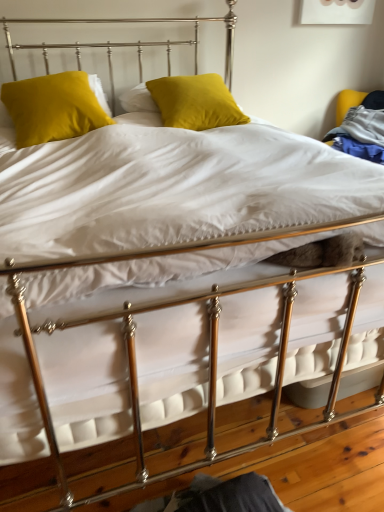
What is the approximate height of satin yellow pillow at center, which is counted as the 1th pillow, starting from the right?

26.45 centimeters.

This screenshot has height=512, width=384. I want to click on satin yellow pillow at center, which is counted as the 1th pillow, starting from the right, so click(x=195, y=102).

The image size is (384, 512). Describe the element at coordinates (195, 102) in the screenshot. I see `satin yellow pillow at center, which is counted as the 1th pillow, starting from the right` at that location.

This screenshot has height=512, width=384. Describe the element at coordinates (53, 106) in the screenshot. I see `velvet yellow pillow at upper left, the 1th pillow from the left` at that location.

In order to face velvet yellow pillow at upper left, the 1th pillow from the left, should I rotate leftwards or rightwards?

Rotate your view left by about 18.452°.

Find the location of a particular element. The width and height of the screenshot is (384, 512). velvet yellow pillow at upper left, the 1th pillow from the left is located at coordinates (53, 106).

Identify the location of satin yellow pillow at center, which is counted as the 1th pillow, starting from the right. The width and height of the screenshot is (384, 512). (195, 102).

Which is more to the right, velvet yellow pillow at upper left, the 1th pillow from the left, or satin yellow pillow at center, which is counted as the 1th pillow, starting from the right?

From the viewer's perspective, satin yellow pillow at center, which is counted as the 1th pillow, starting from the right, appears more on the right side.

Does velvet yellow pillow at upper left, which is the second pillow from right to left, come behind satin yellow pillow at center, which ranks as the 2th pillow in left-to-right order?

No, it is in front of satin yellow pillow at center, which ranks as the 2th pillow in left-to-right order.

Between point (17, 94) and point (169, 104), which one is positioned in front?

The point (17, 94) is closer.

From the image's perspective, which one is positioned lower, velvet yellow pillow at upper left, which is the second pillow from right to left, or satin yellow pillow at center, which ranks as the 2th pillow in left-to-right order?

From the image's view, velvet yellow pillow at upper left, which is the second pillow from right to left, is below.

From a real-world perspective, does velvet yellow pillow at upper left, which is the second pillow from right to left, stand above satin yellow pillow at center, which ranks as the 2th pillow in left-to-right order?

No.

Between velvet yellow pillow at upper left, the 1th pillow from the left, and satin yellow pillow at center, which is counted as the 1th pillow, starting from the right, which one has smaller width?

velvet yellow pillow at upper left, the 1th pillow from the left, is thinner.

Who is taller, velvet yellow pillow at upper left, which is the second pillow from right to left, or satin yellow pillow at center, which ranks as the 2th pillow in left-to-right order?

velvet yellow pillow at upper left, which is the second pillow from right to left, is taller.

Looking at the image, does velvet yellow pillow at upper left, which is the second pillow from right to left, seem bigger or smaller compared to satin yellow pillow at center, which is counted as the 1th pillow, starting from the right?

Considering their sizes, velvet yellow pillow at upper left, which is the second pillow from right to left, takes up more space than satin yellow pillow at center, which is counted as the 1th pillow, starting from the right.

Is velvet yellow pillow at upper left, the 1th pillow from the left, surrounding satin yellow pillow at center, which is counted as the 1th pillow, starting from the right?

No, velvet yellow pillow at upper left, the 1th pillow from the left, does not contain satin yellow pillow at center, which is counted as the 1th pillow, starting from the right.

Is velvet yellow pillow at upper left, which is the second pillow from right to left, touching satin yellow pillow at center, which ranks as the 2th pillow in left-to-right order?

They are not placed beside each other.

Is velvet yellow pillow at upper left, which is the second pillow from right to left, facing towards satin yellow pillow at center, which is counted as the 1th pillow, starting from the right?

No, velvet yellow pillow at upper left, which is the second pillow from right to left, does not turn towards satin yellow pillow at center, which is counted as the 1th pillow, starting from the right.

What's the angular difference between velvet yellow pillow at upper left, which is the second pillow from right to left, and satin yellow pillow at center, which is counted as the 1th pillow, starting from the right,'s facing directions?

The facing directions of velvet yellow pillow at upper left, which is the second pillow from right to left, and satin yellow pillow at center, which is counted as the 1th pillow, starting from the right, are 0.706 degrees apart.

Locate an element on the screen. pillow above the velvet yellow pillow at upper left, the 1th pillow from the left (from the image's perspective) is located at coordinates [x=195, y=102].

Considering the relative positions of satin yellow pillow at center, which ranks as the 2th pillow in left-to-right order, and velvet yellow pillow at upper left, which is the second pillow from right to left, in the image provided, is satin yellow pillow at center, which ranks as the 2th pillow in left-to-right order, to the left of velvet yellow pillow at upper left, which is the second pillow from right to left, from the viewer's perspective?

No.

In the image, is satin yellow pillow at center, which ranks as the 2th pillow in left-to-right order, positioned in front of or behind velvet yellow pillow at upper left, the 1th pillow from the left?

satin yellow pillow at center, which ranks as the 2th pillow in left-to-right order, is behind velvet yellow pillow at upper left, the 1th pillow from the left.

Is point (188, 83) positioned before point (95, 106)?

No.

From the image's perspective, is satin yellow pillow at center, which is counted as the 1th pillow, starting from the right, beneath velvet yellow pillow at upper left, the 1th pillow from the left?

No, from the image's perspective, satin yellow pillow at center, which is counted as the 1th pillow, starting from the right, is not below velvet yellow pillow at upper left, the 1th pillow from the left.

From a real-world perspective, is satin yellow pillow at center, which ranks as the 2th pillow in left-to-right order, located beneath velvet yellow pillow at upper left, the 1th pillow from the left?

No, from a real-world perspective, satin yellow pillow at center, which ranks as the 2th pillow in left-to-right order, is not under velvet yellow pillow at upper left, the 1th pillow from the left.

Can you confirm if satin yellow pillow at center, which ranks as the 2th pillow in left-to-right order, is thinner than velvet yellow pillow at upper left, the 1th pillow from the left?

Incorrect, the width of satin yellow pillow at center, which ranks as the 2th pillow in left-to-right order, is not less than that of velvet yellow pillow at upper left, the 1th pillow from the left.

Based on the photo, considering the relative sizes of satin yellow pillow at center, which is counted as the 1th pillow, starting from the right, and velvet yellow pillow at upper left, which is the second pillow from right to left, in the image provided, is satin yellow pillow at center, which is counted as the 1th pillow, starting from the right, taller than velvet yellow pillow at upper left, which is the second pillow from right to left,?

No, satin yellow pillow at center, which is counted as the 1th pillow, starting from the right, is not taller than velvet yellow pillow at upper left, which is the second pillow from right to left.

Based on their sizes in the image, would you say satin yellow pillow at center, which is counted as the 1th pillow, starting from the right, is bigger or smaller than velvet yellow pillow at upper left, which is the second pillow from right to left?

Considering their sizes, satin yellow pillow at center, which is counted as the 1th pillow, starting from the right, takes up less space than velvet yellow pillow at upper left, which is the second pillow from right to left.

Is satin yellow pillow at center, which is counted as the 1th pillow, starting from the right, outside of velvet yellow pillow at upper left, the 1th pillow from the left?

That's correct, satin yellow pillow at center, which is counted as the 1th pillow, starting from the right, is outside of velvet yellow pillow at upper left, the 1th pillow from the left.

Is satin yellow pillow at center, which ranks as the 2th pillow in left-to-right order, directly adjacent to velvet yellow pillow at upper left, which is the second pillow from right to left?

No, satin yellow pillow at center, which ranks as the 2th pillow in left-to-right order, is not next to velvet yellow pillow at upper left, which is the second pillow from right to left.

Is satin yellow pillow at center, which is counted as the 1th pillow, starting from the right, facing away from velvet yellow pillow at upper left, the 1th pillow from the left?

No, satin yellow pillow at center, which is counted as the 1th pillow, starting from the right, is not facing the opposite direction of velvet yellow pillow at upper left, the 1th pillow from the left.

The image size is (384, 512). I want to click on pillow that appears below the satin yellow pillow at center, which ranks as the 2th pillow in left-to-right order (from the image's perspective), so [53, 106].

You are a GUI agent. You are given a task and a screenshot of the screen. Output one action in this format:
    pyautogui.click(x=<x>, y=<y>)
    Task: Click on the pillow below the satin yellow pillow at center, which is counted as the 1th pillow, starting from the right (from a real-world perspective)
    This screenshot has width=384, height=512.
    Given the screenshot: What is the action you would take?
    pyautogui.click(x=53, y=106)

The height and width of the screenshot is (512, 384). Find the location of `pillow below the satin yellow pillow at center, which is counted as the 1th pillow, starting from the right (from the image's perspective)`. pillow below the satin yellow pillow at center, which is counted as the 1th pillow, starting from the right (from the image's perspective) is located at coordinates (53, 106).